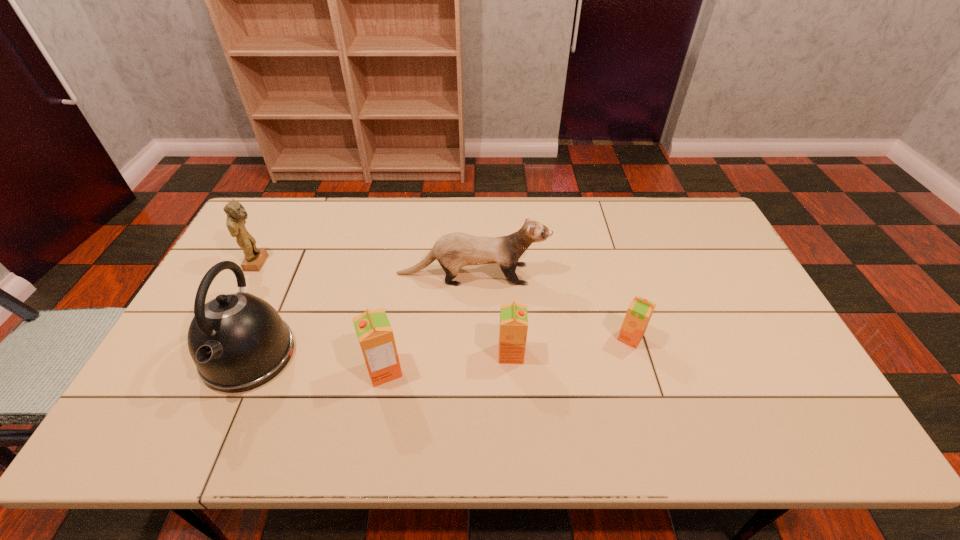
I want to click on object that ranks as the fifth closest to the shortest orange juice, so click(254, 258).

Identify which object is the third closest to the figurine. Please provide its 2D coordinates. Your answer should be formatted as a tuple, i.e. [(x, y)], where the tuple contains the x and y coordinates of a point satisfying the conditions above.

[(374, 332)]

At what (x,y) coordinates should I click in order to perform the action: click on orange juice that stands as the closest to the leftmost orange juice. Please return your answer as a coordinate pair (x, y). The image size is (960, 540). Looking at the image, I should click on (513, 328).

I want to click on the third closest orange juice to the ferret, so click(x=374, y=332).

Where is `free region that satisfies the following two spatial constraints: 1. on the spout of the leftmost orange juice; 2. on the left side of the tallest object`? free region that satisfies the following two spatial constraints: 1. on the spout of the leftmost orange juice; 2. on the left side of the tallest object is located at coordinates (243, 370).

The width and height of the screenshot is (960, 540). Identify the location of vacant area that satisfies the following two spatial constraints: 1. on the face of the shortest object; 2. on the left side of the ferret. (470, 338).

This screenshot has width=960, height=540. I want to click on free spot that satisfies the following two spatial constraints: 1. on the face of the ferret; 2. on the back side of the second orange juice from right to left, so click(470, 354).

The image size is (960, 540). What are the coordinates of `free location that satisfies the following two spatial constraints: 1. on the back side of the leftmost orange juice; 2. on the front-facing side of the figurine` in the screenshot? It's located at (403, 263).